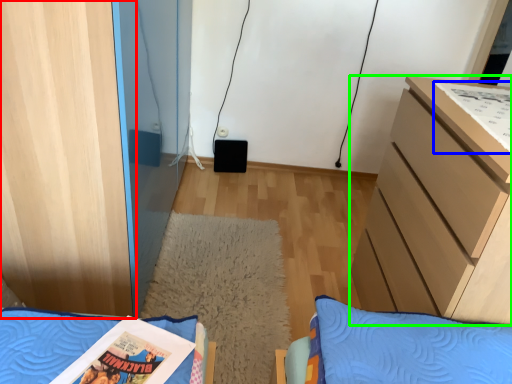
Question: Which object is positioned farthest from cabinetry (highlighted by a red box)? Select from comic book (highlighted by a blue box) and chest of drawers (highlighted by a green box).

Choices:
 (A) comic book
 (B) chest of drawers

Answer: (A)